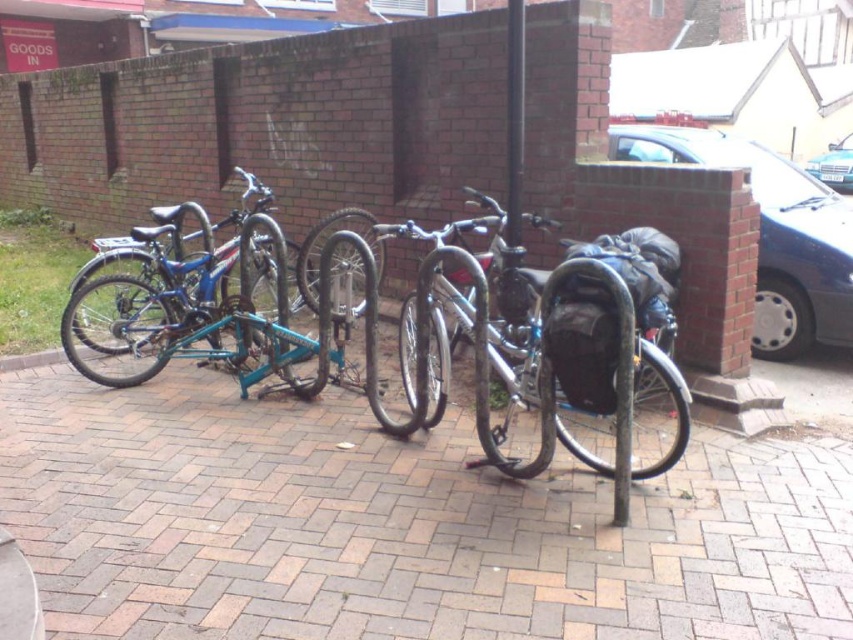
Is black metal pole at center thinner than metallic blue car at upper right?

Yes.

Does black metal pole at center have a smaller size compared to metallic blue car at upper right?

Indeed, black metal pole at center has a smaller size compared to metallic blue car at upper right.

The image size is (853, 640). What do you see at coordinates (514, 131) in the screenshot?
I see `black metal pole at center` at bounding box center [514, 131].

Identify the location of black metal pole at center. The height and width of the screenshot is (640, 853). (514, 131).

Which is more to the right, brick pavement at center or blue metallic bicycle at left?

From the viewer's perspective, brick pavement at center appears more on the right side.

Between brick pavement at center and blue metallic bicycle at left, which one has more height?

Standing taller between the two is blue metallic bicycle at left.

Is point (480, 476) positioned after point (173, 218)?

No, it is not.

At what (x,y) coordinates should I click in order to perform the action: click on brick pavement at center. Please return your answer as a coordinate pair (x, y). The width and height of the screenshot is (853, 640). Looking at the image, I should click on (398, 525).

Which of these two, brick pavement at center or metallic blue car at upper right, stands taller?

metallic blue car at upper right

Image resolution: width=853 pixels, height=640 pixels. What do you see at coordinates (398, 525) in the screenshot?
I see `brick pavement at center` at bounding box center [398, 525].

Who is more forward, (546, 509) or (805, 164)?

Point (546, 509) is more forward.

The image size is (853, 640). Find the location of `brick pavement at center`. brick pavement at center is located at coordinates (398, 525).